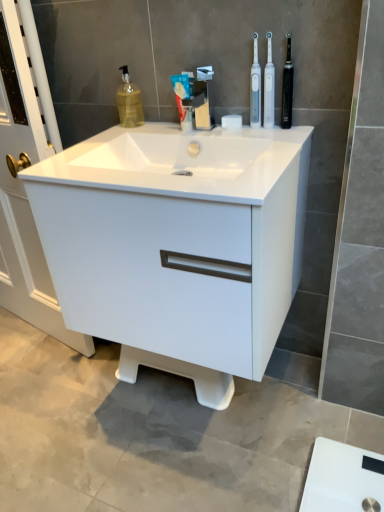
Question: Looking at their shapes, would you say black rubber toothbrush at upper right is wider or thinner than white glossy sink at center?

Choices:
 (A) wide
 (B) thin

Answer: (B)

Question: Considering the relative positions of black rubber toothbrush at upper right and white glossy sink at center in the image provided, is black rubber toothbrush at upper right to the left or to the right of white glossy sink at center?

Choices:
 (A) left
 (B) right

Answer: (B)

Question: Considering the real-world distances, which object is closest to the black rubber toothbrush at upper right?

Choices:
 (A) white plastic toothbrush at upper right, which is the 2th toothbrush in left-to-right order
 (B) white glossy cabinet at center
 (C) white glossy sink at center
 (D) satin nickel faucet at center
 (E) white matte toothpaste at center

Answer: (A)

Question: Based on their relative distances, which object is farther from the black rubber toothbrush at upper right?

Choices:
 (A) white plastic toothbrush at upper right, the second toothbrush positioned from the right
 (B) satin nickel faucet at center
 (C) white plastic toothbrush at upper right, which is counted as the first toothbrush, starting from the right
 (D) white glossy cabinet at center
 (E) white matte toothpaste at center

Answer: (D)